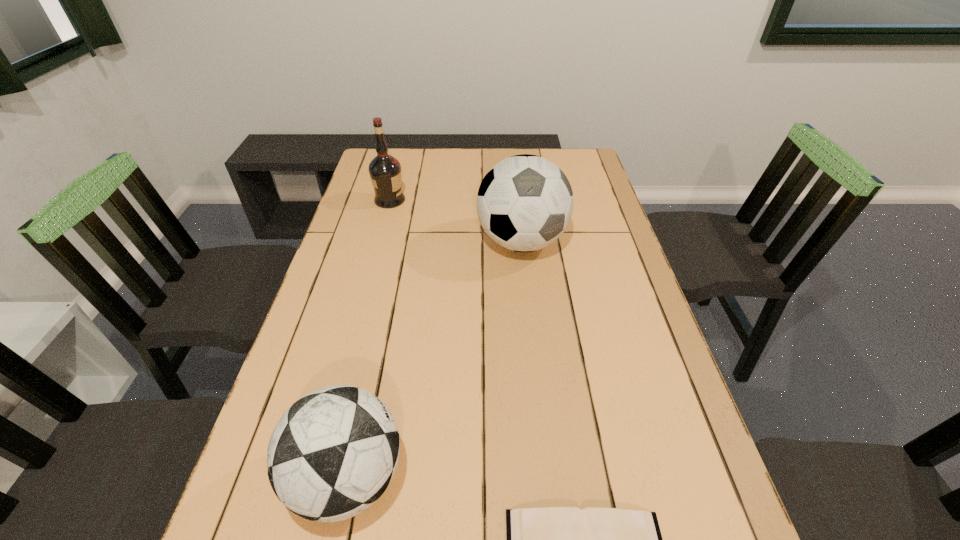
In the image, there is a desktop. Identify the location of vacant region at the far right corner. Image resolution: width=960 pixels, height=540 pixels. (586, 149).

Identify the location of free spot between the liquor and the taller soccer ball. (456, 221).

Identify the location of empty space that is in between the taller soccer ball and the farthest object. (456, 221).

This screenshot has height=540, width=960. I want to click on unoccupied area between the third nearest object and the liquor, so click(456, 221).

Choose which object is the second nearest neighbor to the nearer soccer ball. Please provide its 2D coordinates. Your answer should be formatted as a tuple, i.e. [(x, y)], where the tuple contains the x and y coordinates of a point satisfying the conditions above.

[(524, 203)]

Point out which object is positioned as the second nearest to the right soccer ball. Please provide its 2D coordinates. Your answer should be formatted as a tuple, i.e. [(x, y)], where the tuple contains the x and y coordinates of a point satisfying the conditions above.

[(333, 453)]